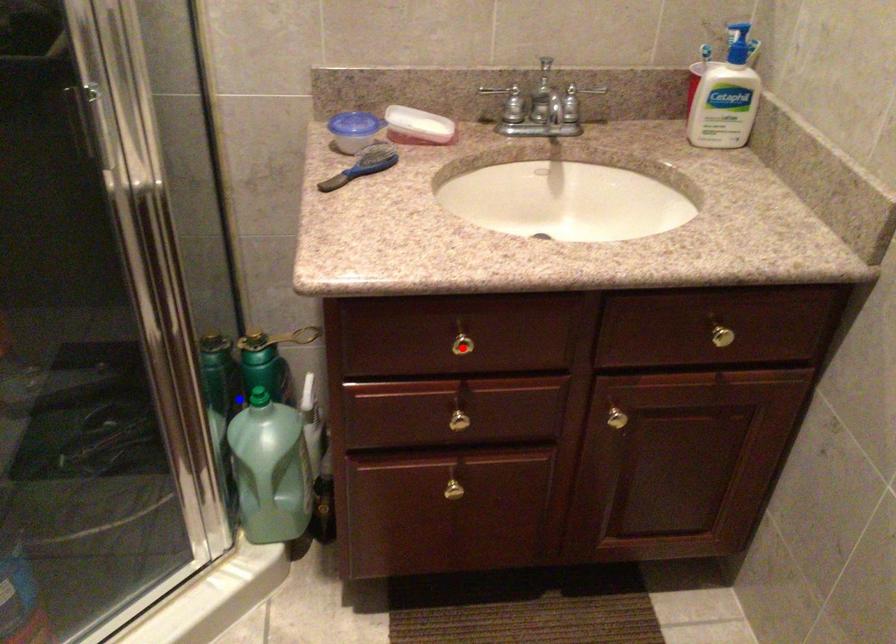
Question: Which of the two points in the image is closer to the camera?

Choices:
 (A) Blue point is closer.
 (B) Red point is closer.

Answer: (B)